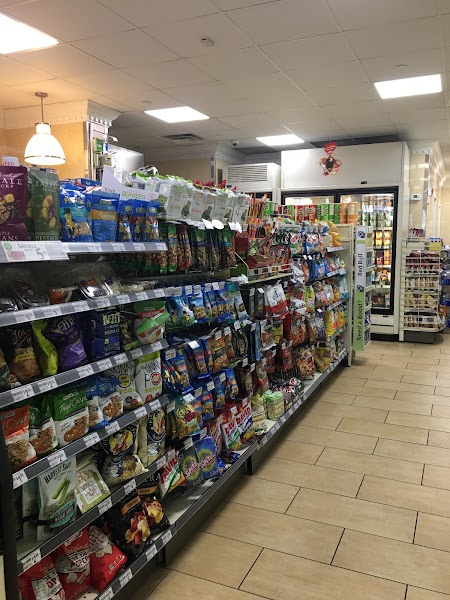
Image resolution: width=450 pixels, height=600 pixels. Identify the location of ceiling vent. (183, 137).